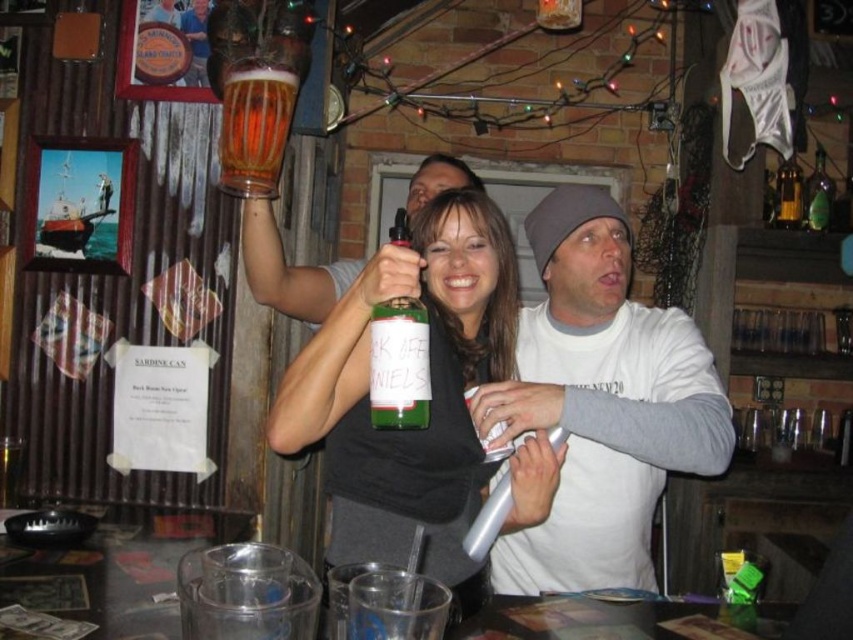
Which is above, green matte bottle at center or green glass bottle at upper right?

green glass bottle at upper right is above.

Which of these two, green matte bottle at center or green glass bottle at upper right, stands taller?

green matte bottle at center

Is point (456, 509) positioned in front of point (811, 204)?

Yes, it is.

Locate an element on the screen. The height and width of the screenshot is (640, 853). green matte bottle at center is located at coordinates (431, 390).

Is point (460, 467) farther from viewer compared to point (274, 132)?

That is False.

Is green matte bottle at center below translucent glass mug at upper center?

Yes, green matte bottle at center is below translucent glass mug at upper center.

This screenshot has height=640, width=853. Identify the location of green matte bottle at center. (431, 390).

Which is more to the right, translucent glass mug at upper center or green glass bottle at upper right?

green glass bottle at upper right is more to the right.

Between translucent glass mug at upper center and green glass bottle at upper right, which one is positioned higher?

green glass bottle at upper right is above.

This screenshot has height=640, width=853. Describe the element at coordinates (254, 129) in the screenshot. I see `translucent glass mug at upper center` at that location.

Locate an element on the screen. The image size is (853, 640). translucent glass mug at upper center is located at coordinates (254, 129).